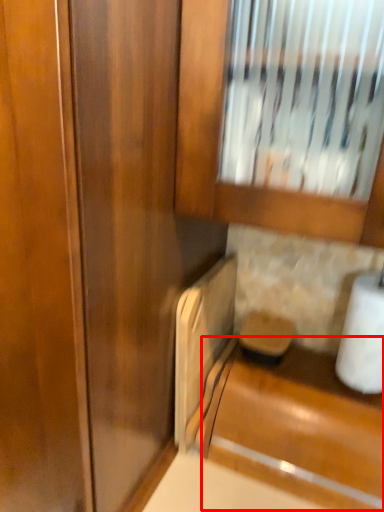
Question: Observing the image, what is the correct spatial positioning of cabinetry (annotated by the red box) in reference to toilet paper?

Choices:
 (A) right
 (B) left

Answer: (B)